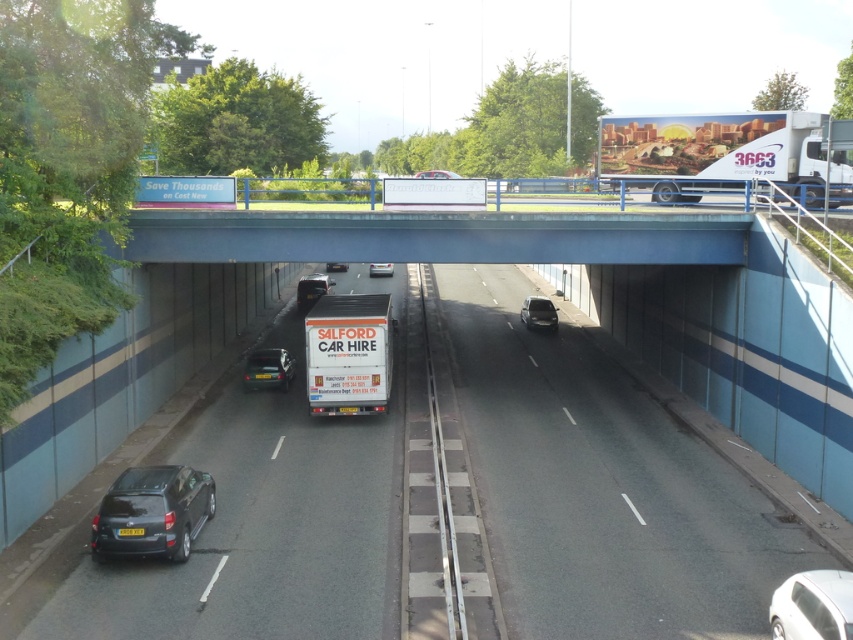
Question: Does dark gray matte hatchback at lower left appear under white glossy sedan at lower right?

Choices:
 (A) yes
 (B) no

Answer: (B)

Question: Which of these objects is positioned closest to the dark gray matte hatchback at lower left?

Choices:
 (A) shiny black sedan at center
 (B) white matte van at center
 (C) white glossy sedan at lower right
 (D) matte black van at center

Answer: (B)

Question: Is shiny black sedan at center to the left of matte black van at center from the viewer's perspective?

Choices:
 (A) yes
 (B) no

Answer: (B)

Question: Does matte black car at center lie in front of white matte van at center?

Choices:
 (A) no
 (B) yes

Answer: (A)

Question: Which point is closer to the camera?

Choices:
 (A) shiny black sedan at center
 (B) white matte van at center
 (C) white matte trailer truck at center

Answer: (C)

Question: Among these points, which one is nearest to the camera?

Choices:
 (A) pyautogui.click(x=347, y=360)
 (B) pyautogui.click(x=379, y=262)

Answer: (B)